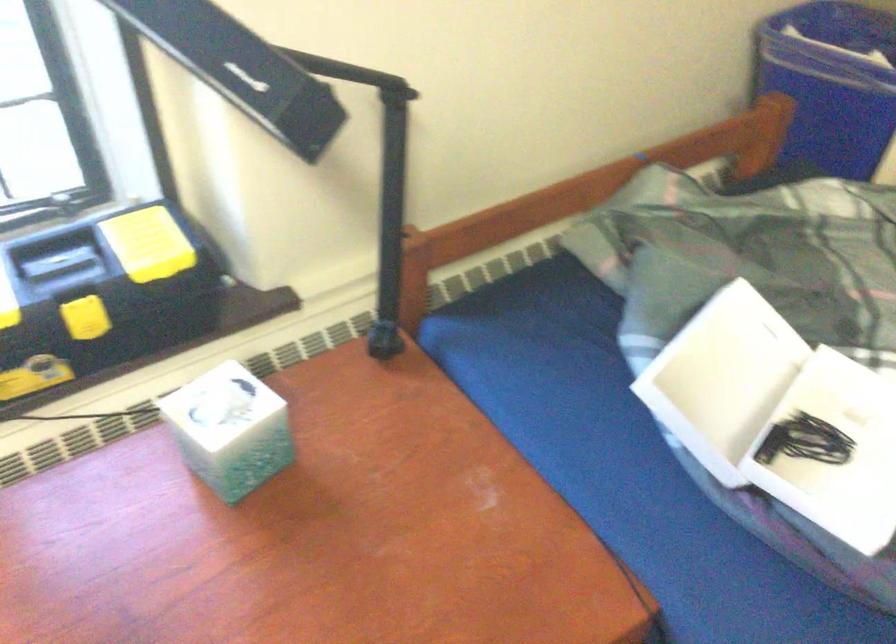
Find the location of a particular element. The image size is (896, 644). black lamp head is located at coordinates (240, 70).